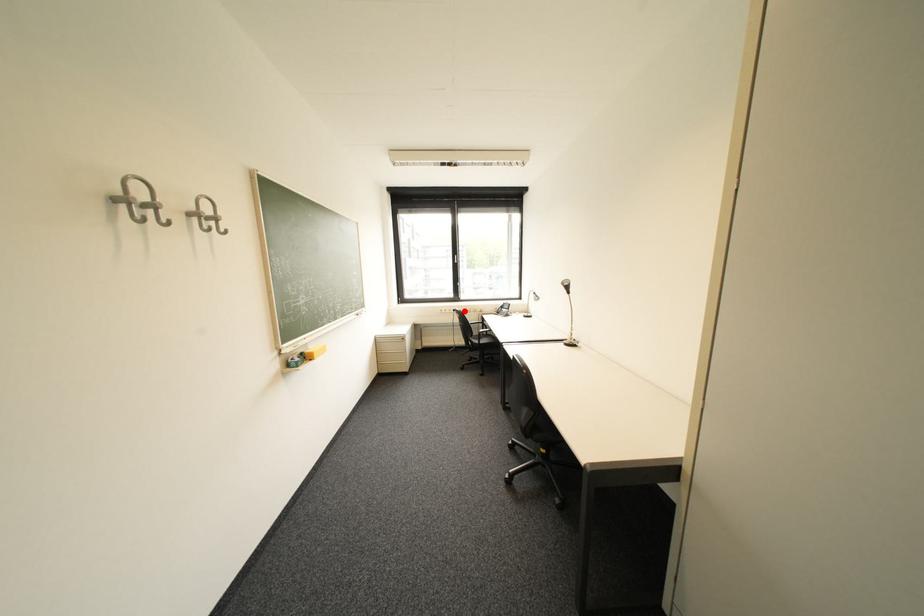
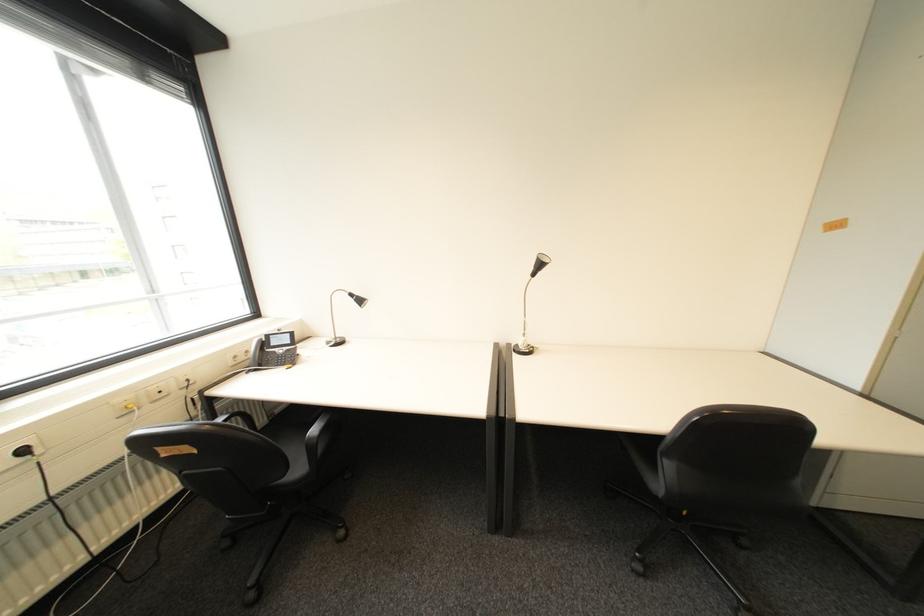
Question: A red point is marked in image1. In image2, is the corresponding 3D point closer to the camera or farther? Reply with the corresponding letter.

Choices:
 (A) The corresponding 3D point is closer.
 (B) The corresponding 3D point is farther.

Answer: (A)